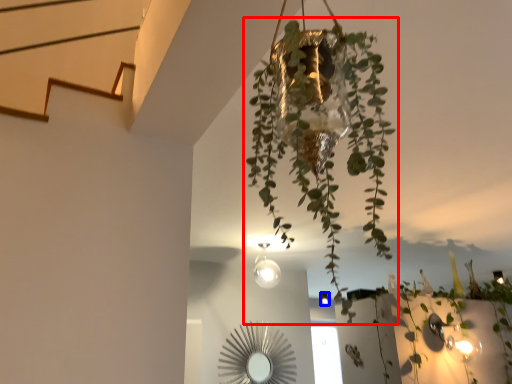
Question: Which object appears farthest to the camera in this image, houseplant (highlighted by a red box) or light fixture (highlighted by a blue box)?

Choices:
 (A) houseplant
 (B) light fixture

Answer: (B)